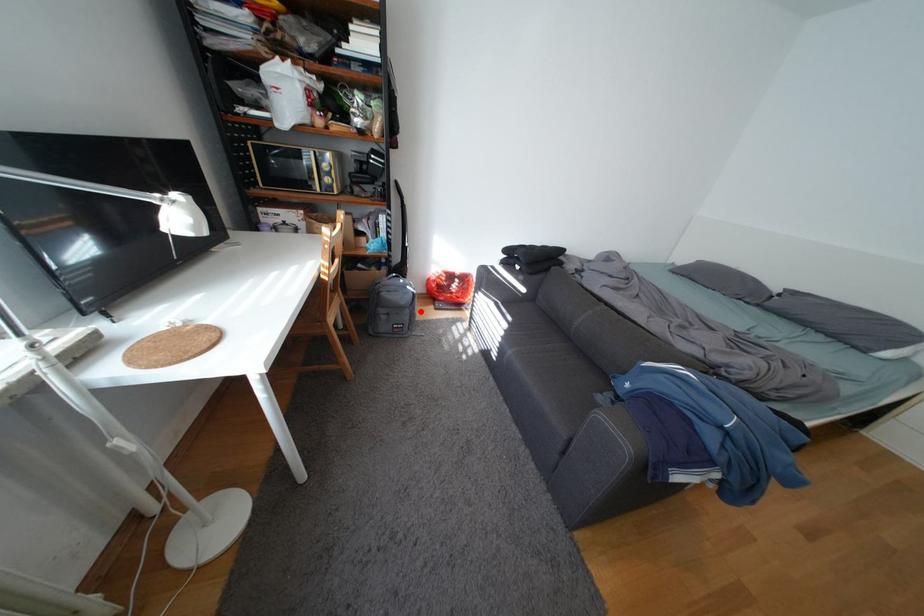
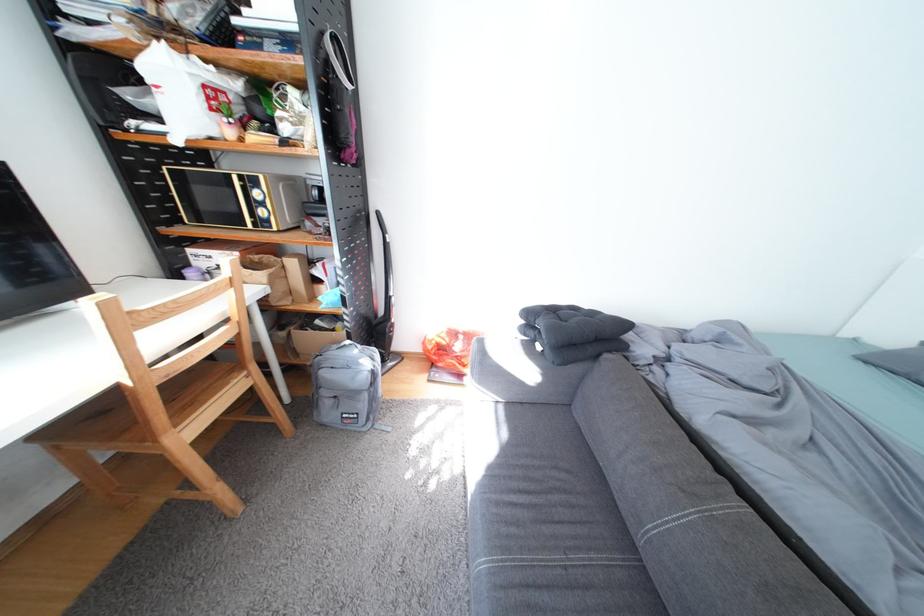
In the second image, find the point that corresponds to the highlighted location in the first image.

(378, 397)